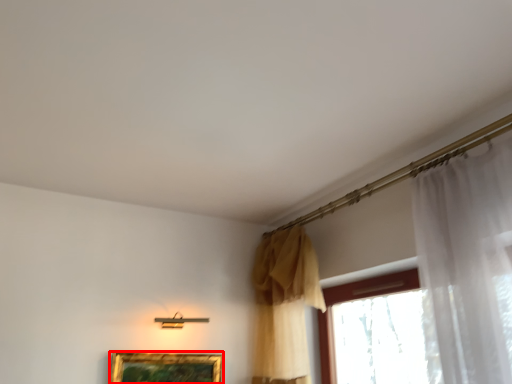
Question: From the image's perspective, where is picture frame (annotated by the red box) located relative to curtain?

Choices:
 (A) above
 (B) below

Answer: (B)